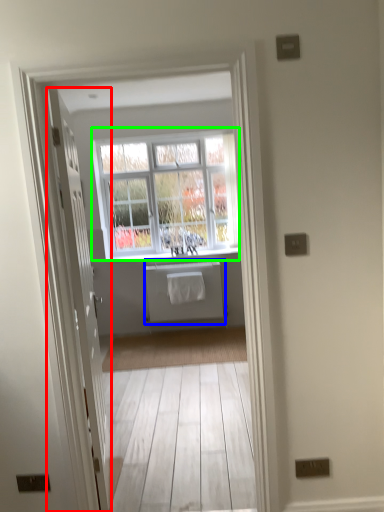
Question: Considering the real-world distances, which object is closest to door (highlighted by a red box)? appliance (highlighted by a blue box) or window (highlighted by a green box).

Choices:
 (A) appliance
 (B) window

Answer: (A)